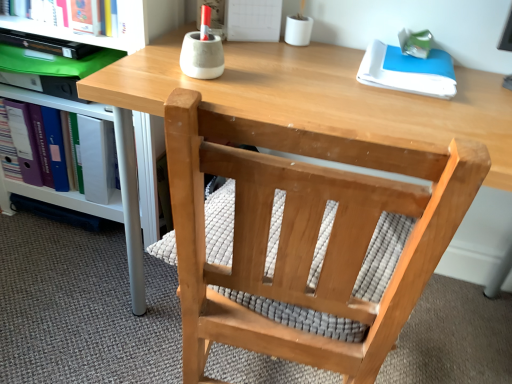
You are a GUI agent. You are given a task and a screenshot of the screen. Output one action in this format:
    pyautogui.click(x=<x>, y=<y>)
    Task: Click on the vacant area that is in front of white glossy shelf at lower left
    This screenshot has height=384, width=512.
    Given the screenshot: What is the action you would take?
    pyautogui.click(x=65, y=296)